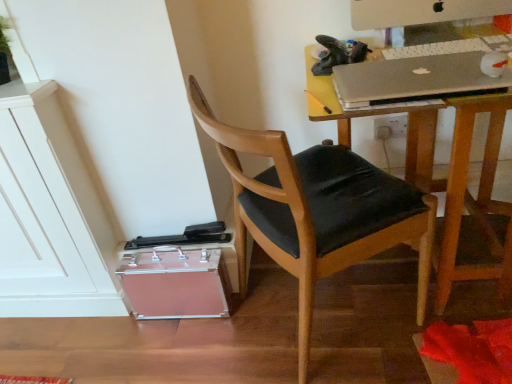
Question: From the image's perspective, relative to wooden chair with black cushion at center, is white plastic computer monitor at upper right above or below?

Choices:
 (A) above
 (B) below

Answer: (A)

Question: Based on their positions, is white plastic computer monitor at upper right located to the left or right of wooden chair with black cushion at center?

Choices:
 (A) right
 (B) left

Answer: (A)

Question: Which is nearer to the metallic silver desk at upper right?

Choices:
 (A) wooden chair with black cushion at center
 (B) white plastic keyboard at upper right
 (C) white plastic computer monitor at upper right
 (D) silver metallic laptop at upper right

Answer: (D)

Question: Estimate the real-world distances between objects in this image. Which object is farther from the white plastic computer monitor at upper right?

Choices:
 (A) metallic silver desk at upper right
 (B) white plastic keyboard at upper right
 (C) wooden chair with black cushion at center
 (D) silver metallic laptop at upper right

Answer: (C)